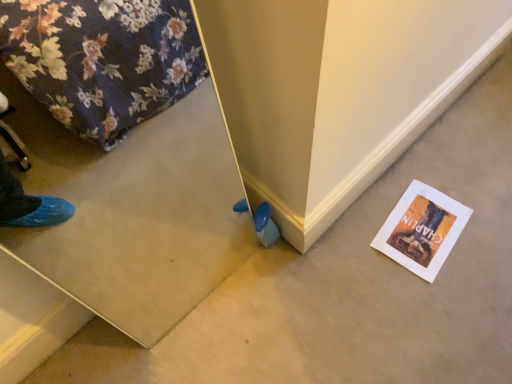
The width and height of the screenshot is (512, 384). Find the location of `free space above white paper at lower right (from a real-world perspective)`. free space above white paper at lower right (from a real-world perspective) is located at coordinates (415, 222).